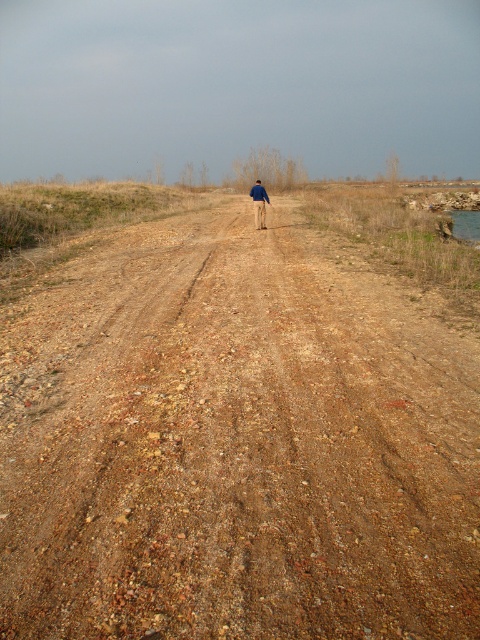
Question: Which point is farther from the camera taking this photo?

Choices:
 (A) (312, 412)
 (B) (262, 186)

Answer: (B)

Question: Does brown gravel dirt track at center appear on the right side of blue denim jacket at center?

Choices:
 (A) no
 (B) yes

Answer: (A)

Question: Is brown gravel dirt track at center above blue denim jacket at center?

Choices:
 (A) yes
 (B) no

Answer: (B)

Question: Is brown gravel dirt track at center to the right of blue denim jacket at center from the viewer's perspective?

Choices:
 (A) no
 (B) yes

Answer: (A)